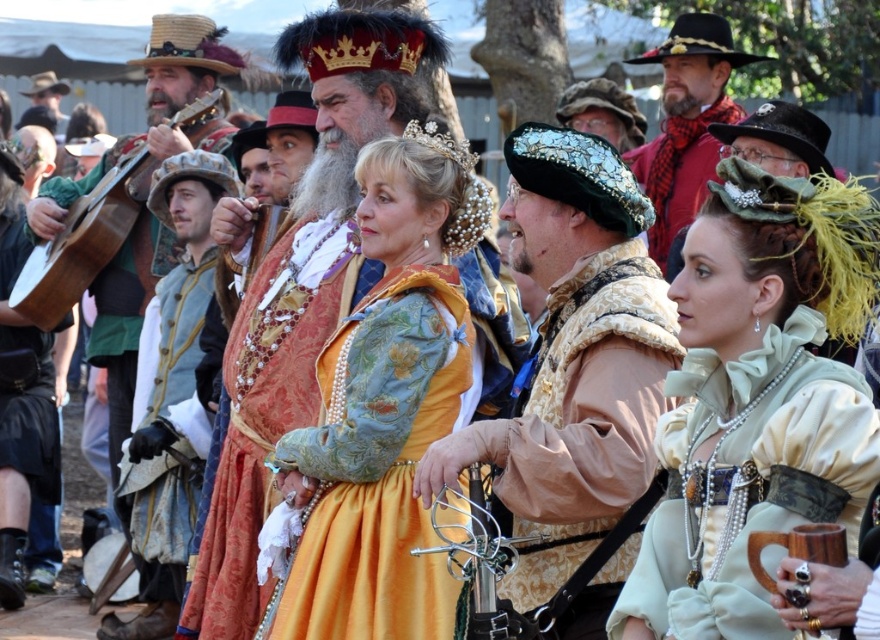
You are a photographer at the Renaissance fair and want to capture a photo of the matte gold dress at center. Based on its position, where should you aim your camera?

The matte gold dress at center is located at position point (380, 412), so aim your camera there.

You are a costume designer observing the Renaissance fair. You need to determine which costume is shorter between the matte gold dress at center and the light blue fabric coat at left. Which one is shorter?

The matte gold dress at center is shorter than the light blue fabric coat at left, so the matte gold dress at center is the shorter one.

You are a guest at the Renaissance fair and want to take a photo with the gold brocade robe at center and the matte red scarf at center. Since you have a camera with a 50 meter range, will you be able to capture both objects in the same frame?

The gold brocade robe at center is 34.27 meters away from the matte red scarf at center. Since your camera has a 50 meter range, you can capture both objects in the same frame as they are within the camera range.